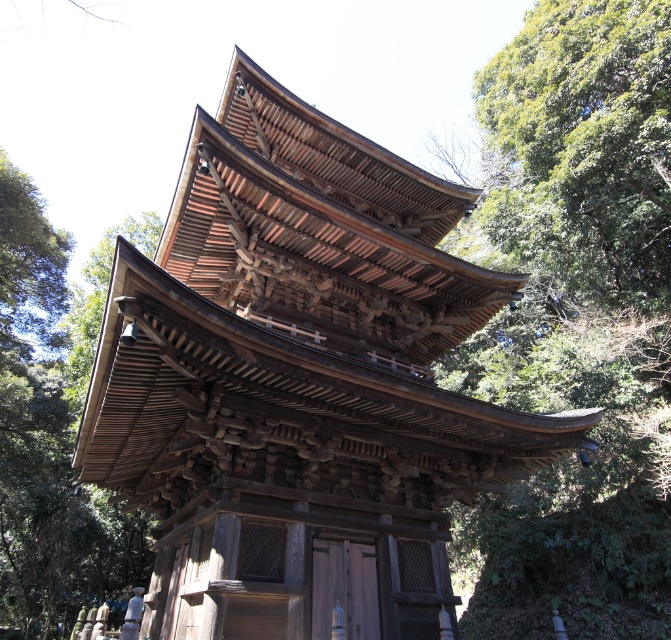
You are standing in front of the wooden temple at center and looking towards the green leafy tree at upper right. Which object is closer to you?

The wooden temple at center is closer to you since it is in front of the green leafy tree at upper right.

You are a visitor standing at the entrance of the wooden temple at center. Looking up, you notice a green leafy tree at upper right. Based on the structure, can you determine if the tree is positioned above or below the temple?

The wooden temple at center is located below the green leafy tree at upper right, so the tree is positioned above the temple.

You are standing at the entrance of a traditional Japanese wooden structure. You want to take a photo of the wooden temple at center. Where should you position yourself to ensure the temple is centered in your photo?

To center the wooden temple at center in your photo, position yourself directly in front of the temple at point (301, 384).